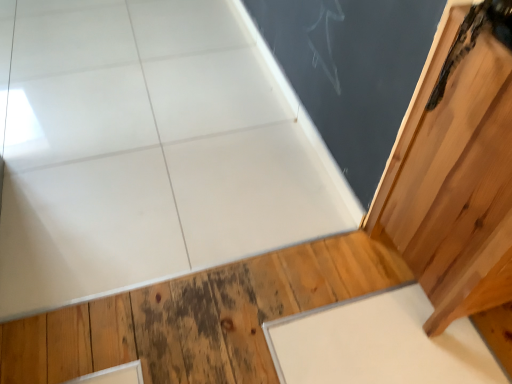
The image size is (512, 384). What are the coordinates of `free spot to the left of white matte slate at lower right` in the screenshot? It's located at (233, 317).